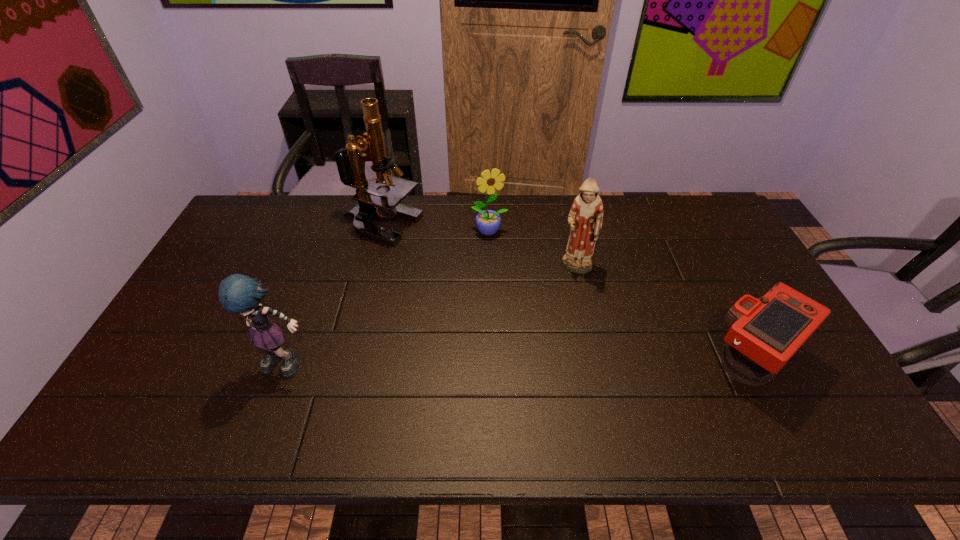
The height and width of the screenshot is (540, 960). Identify the location of blank area located at the eyepiece of the microscope. tap(444, 276).

What are the coordinates of `free space located 0.200m at the eyepiece of the microscope` in the screenshot? It's located at (442, 274).

Locate an element on the screen. Image resolution: width=960 pixels, height=540 pixels. free space located 0.120m on the front-facing side of the second object from right to left is located at coordinates (578, 312).

Where is `vacant space located on the front-facing side of the second object from right to left`? The width and height of the screenshot is (960, 540). vacant space located on the front-facing side of the second object from right to left is located at coordinates (578, 401).

In order to click on free space located on the front-facing side of the second object from right to left in this screenshot , I will do `click(578, 376)`.

The width and height of the screenshot is (960, 540). I want to click on free space located 0.170m on the front-facing side of the sunflower, so click(x=507, y=275).

You are a GUI agent. You are given a task and a screenshot of the screen. Output one action in this format:
    pyautogui.click(x=<x>, y=<y>)
    Task: Click on the free space located 0.390m on the front-facing side of the sunflower
    
    Given the screenshot: What is the action you would take?
    pyautogui.click(x=528, y=330)

Where is `vacant space positioned 0.230m on the front-facing side of the sunflower`? The width and height of the screenshot is (960, 540). vacant space positioned 0.230m on the front-facing side of the sunflower is located at coordinates (512, 288).

Where is `microscope that is positioned at the far edge`? The width and height of the screenshot is (960, 540). microscope that is positioned at the far edge is located at coordinates (350, 162).

Identify the location of sunflower that is positioned at the far edge. This screenshot has height=540, width=960. (488, 222).